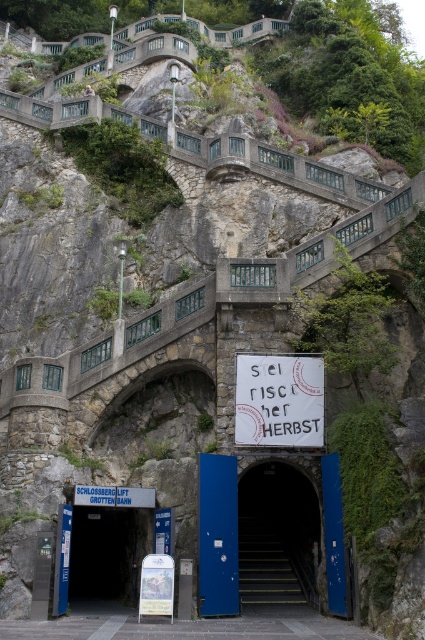
Which of these two, blue metal stairs at center or blue metallic door at center, stands shorter?

blue metal stairs at center

Who is more distant from viewer, (280, 504) or (85, 580)?

The point (85, 580) is more distant.

Find the location of a particular element. The height and width of the screenshot is (640, 425). blue metal stairs at center is located at coordinates (277, 536).

Can you confirm if white paper sign at center is thinner than yellow/golden metal stairs at center?

No, white paper sign at center is not thinner than yellow/golden metal stairs at center.

Is point (282, 388) more distant than point (246, 561)?

No, (282, 388) is closer to viewer.

At what (x,y) coordinates should I click in order to perform the action: click on white paper sign at center. Please return your answer as a coordinate pair (x, y). Looking at the image, I should click on (278, 401).

The height and width of the screenshot is (640, 425). Identify the location of white paper sign at center. (278, 401).

Between point (317, 531) and point (300, 362), which one is positioned in front?

Positioned in front is point (300, 362).

Which is in front, point (303, 552) or point (274, 422)?

Positioned in front is point (274, 422).

Image resolution: width=425 pixels, height=640 pixels. What are the coordinates of `blue metal stairs at center` in the screenshot? It's located at (277, 536).